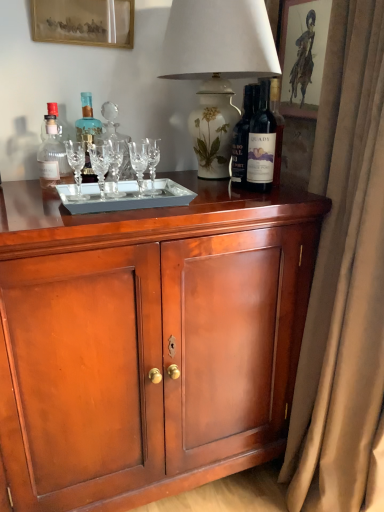
Find the location of a particular element. beige velvet curtain at right is located at coordinates (344, 280).

Describe the element at coordinates (344, 280) in the screenshot. I see `beige velvet curtain at right` at that location.

The width and height of the screenshot is (384, 512). What do you see at coordinates (217, 64) in the screenshot?
I see `white floral vase at upper center` at bounding box center [217, 64].

Locate an element on the screen. white floral vase at upper center is located at coordinates pos(217,64).

Measure the distance between matte brown picture frame at upper right, which ranks as the 2th picture frame in left-to-right order, and camera.

4.32 feet.

You are a GUI agent. You are given a task and a screenshot of the screen. Output one action in this format:
    pyautogui.click(x=<x>, y=<y>)
    Task: Click on the gold-framed picture at upper left, which appears as the second picture frame when viewed from the right
    
    Given the screenshot: What is the action you would take?
    tap(84, 22)

Where is `matte glass bottle at left, the first bottle from the left`? This screenshot has height=512, width=384. matte glass bottle at left, the first bottle from the left is located at coordinates (52, 154).

Which is in front, matte glass bottle at left, the third bottle from the right, or gold-framed picture at upper left, which appears as the second picture frame when viewed from the right?

matte glass bottle at left, the third bottle from the right, is more forward.

Which object is wider, matte glass bottle at left, the third bottle from the right, or gold-framed picture at upper left, which appears as the second picture frame when viewed from the right?

matte glass bottle at left, the third bottle from the right, is wider.

Can you tell me how much matte glass bottle at left, the third bottle from the right, and gold-framed picture at upper left, which appears as the second picture frame when viewed from the right, differ in facing direction?

0.162 degrees separate the facing orientations of matte glass bottle at left, the third bottle from the right, and gold-framed picture at upper left, which appears as the second picture frame when viewed from the right.

From the image's perspective, is matte glass bottle at left, the first bottle from the left, below gold-framed picture at upper left, which appears as the second picture frame when viewed from the right?

Correct, matte glass bottle at left, the first bottle from the left, appears lower than gold-framed picture at upper left, which appears as the second picture frame when viewed from the right, in the image.

Can you confirm if mahogany cabinet at center is positioned to the left of matte brown picture frame at upper right, the first picture frame viewed from the right?

Correct, you'll find mahogany cabinet at center to the left of matte brown picture frame at upper right, the first picture frame viewed from the right.

How much distance is there between mahogany cabinet at center and matte brown picture frame at upper right, the first picture frame viewed from the right?

mahogany cabinet at center and matte brown picture frame at upper right, the first picture frame viewed from the right, are 33.36 inches apart from each other.

Which is behind, point (38, 333) or point (296, 87)?

The point (296, 87) is farther.

From the image's perspective, is mahogany cabinet at center on matte brown picture frame at upper right, the first picture frame viewed from the right?

No, from the image's perspective, mahogany cabinet at center is not over matte brown picture frame at upper right, the first picture frame viewed from the right.

Does matte brown picture frame at upper right, the first picture frame viewed from the right, have a greater height compared to beige velvet curtain at right?

Incorrect, the height of matte brown picture frame at upper right, the first picture frame viewed from the right, is not larger of that of beige velvet curtain at right.

Where is `the 1st picture frame above the beige velvet curtain at right (from a real-world perspective)`? The width and height of the screenshot is (384, 512). the 1st picture frame above the beige velvet curtain at right (from a real-world perspective) is located at coordinates (302, 55).

Can we say matte brown picture frame at upper right, which ranks as the 2th picture frame in left-to-right order, lies outside beige velvet curtain at right?

Yes, matte brown picture frame at upper right, which ranks as the 2th picture frame in left-to-right order, is outside of beige velvet curtain at right.

Is matte brown picture frame at upper right, the first picture frame viewed from the right, wider or thinner than beige velvet curtain at right?

Considering their sizes, matte brown picture frame at upper right, the first picture frame viewed from the right, looks slimmer than beige velvet curtain at right.

Which object is thinner, white floral vase at upper center or matte brown picture frame at upper right, the first picture frame viewed from the right?

matte brown picture frame at upper right, the first picture frame viewed from the right, is thinner.

From a real-world perspective, count 1st picture frames upward from the white floral vase at upper center and point to it. Please provide its 2D coordinates.

[(302, 55)]

In the scene shown: Is the surface of white floral vase at upper center in direct contact with matte brown picture frame at upper right, which ranks as the 2th picture frame in left-to-right order?

They are not placed beside each other.

Considering the sizes of matte brown picture frame at upper right, which ranks as the 2th picture frame in left-to-right order, and mahogany cabinet at center in the image, is matte brown picture frame at upper right, which ranks as the 2th picture frame in left-to-right order, bigger or smaller than mahogany cabinet at center?

Considering their sizes, matte brown picture frame at upper right, which ranks as the 2th picture frame in left-to-right order, takes up less space than mahogany cabinet at center.

From the image's perspective, between matte brown picture frame at upper right, the first picture frame viewed from the right, and mahogany cabinet at center, who is located below?

From the image's view, mahogany cabinet at center is below.

How many degrees apart are the facing directions of matte brown picture frame at upper right, the first picture frame viewed from the right, and mahogany cabinet at center?

89.2 degrees.

Which object is positioned more to the right, matte brown picture frame at upper right, the first picture frame viewed from the right, or mahogany cabinet at center?

From the viewer's perspective, matte brown picture frame at upper right, the first picture frame viewed from the right, appears more on the right side.

Looking at the image, does dark glass bottle at upper right, arranged as the 1th bottle when viewed from the right, seem bigger or smaller compared to matte glass bottle at left, the third bottle from the right?

Considering their sizes, dark glass bottle at upper right, arranged as the 1th bottle when viewed from the right, takes up more space than matte glass bottle at left, the third bottle from the right.

Which is more to the right, dark glass bottle at upper right, arranged as the 1th bottle when viewed from the right, or matte glass bottle at left, the third bottle from the right?

From the viewer's perspective, dark glass bottle at upper right, arranged as the 1th bottle when viewed from the right, appears more on the right side.

Image resolution: width=384 pixels, height=512 pixels. I want to click on the 1st bottle behind when counting from the dark glass bottle at upper right, arranged as the 1th bottle when viewed from the right, so click(x=52, y=154).

Considering the relative sizes of dark glass bottle at upper right, which ranks as the third bottle in left-to-right order, and matte glass bottle at left, the third bottle from the right, in the image provided, is dark glass bottle at upper right, which ranks as the third bottle in left-to-right order, shorter than matte glass bottle at left, the third bottle from the right,?

No.

From a real-world perspective, is white floral vase at upper center located higher than mahogany cabinet at center?

Correct, in the physical world, white floral vase at upper center is higher than mahogany cabinet at center.

Between point (204, 11) and point (56, 298), which one is positioned behind?

Point (204, 11)

Does white floral vase at upper center have a lesser width compared to mahogany cabinet at center?

Yes, white floral vase at upper center is thinner than mahogany cabinet at center.

Which is more to the left, white floral vase at upper center or mahogany cabinet at center?

mahogany cabinet at center.

Identify the location of the 2nd picture frame above the matte glass bottle at left, the third bottle from the right (from a real-world perspective). This screenshot has width=384, height=512. (84, 22).

At what (x,y) coordinates should I click in order to perform the action: click on the 1st picture frame positioned above the mahogany cabinet at center (from the image's perspective). Please return your answer as a coordinate pair (x, y). This screenshot has width=384, height=512. Looking at the image, I should click on (302, 55).

From the image, which object appears to be nearer to dark glass bottle at upper right, arranged as the 1th bottle when viewed from the right, blue glass bottle at center, which is the 2th bottle from right to left, or mahogany cabinet at center?

The object closer to dark glass bottle at upper right, arranged as the 1th bottle when viewed from the right, is mahogany cabinet at center.

Consider the image. When comparing their distances from gold-framed picture at upper left, marked as the first picture frame in a left-to-right arrangement, does matte brown picture frame at upper right, which ranks as the 2th picture frame in left-to-right order, or matte glass bottle at left, the first bottle from the left, seem further?

matte brown picture frame at upper right, which ranks as the 2th picture frame in left-to-right order.

Looking at the image, which one is located closer to blue glass bottle at center, which is the 2th bottle from right to left, matte glass bottle at left, the first bottle from the left, or matte brown picture frame at upper right, which ranks as the 2th picture frame in left-to-right order?

matte glass bottle at left, the first bottle from the left, lies closer to blue glass bottle at center, which is the 2th bottle from right to left, than the other object.

Based on the photo, based on their spatial positions, is dark glass bottle at upper right, which ranks as the third bottle in left-to-right order, or matte brown picture frame at upper right, the first picture frame viewed from the right, further from matte glass bottle at left, the first bottle from the left?

matte brown picture frame at upper right, the first picture frame viewed from the right, lies further to matte glass bottle at left, the first bottle from the left, than the other object.

Consider the image. Considering their positions, is mahogany cabinet at center positioned further to matte glass bottle at left, the first bottle from the left, than white floral vase at upper center?

mahogany cabinet at center lies further to matte glass bottle at left, the first bottle from the left, than the other object.

Estimate the real-world distances between objects in this image. Which object is closer to matte glass bottle at left, the first bottle from the left, matte brown picture frame at upper right, which ranks as the 2th picture frame in left-to-right order, or blue glass bottle at center, positioned as the second bottle in left-to-right order?

blue glass bottle at center, positioned as the second bottle in left-to-right order, lies closer to matte glass bottle at left, the first bottle from the left, than the other object.

From the image, which object appears to be farther from mahogany cabinet at center, white floral vase at upper center or matte glass bottle at left, the first bottle from the left?

matte glass bottle at left, the first bottle from the left.

Considering their positions, is blue glass bottle at center, positioned as the second bottle in left-to-right order, positioned closer to dark glass bottle at upper right, arranged as the 1th bottle when viewed from the right, than beige velvet curtain at right?

beige velvet curtain at right.

You are a GUI agent. You are given a task and a screenshot of the screen. Output one action in this format:
    pyautogui.click(x=<x>, y=<y>)
    Task: Click on the picture frame between matte glass bottle at left, the third bottle from the right, and matte brown picture frame at upper right, which ranks as the 2th picture frame in left-to-right order, from left to right
    
    Given the screenshot: What is the action you would take?
    pyautogui.click(x=84, y=22)

Where is `curtain between white floral vase at upper center and mahogany cabinet at center in the vertical direction`? This screenshot has width=384, height=512. curtain between white floral vase at upper center and mahogany cabinet at center in the vertical direction is located at coordinates (344, 280).

Where is `table lamp situated between gold-framed picture at upper left, which appears as the second picture frame when viewed from the right, and matte brown picture frame at upper right, the first picture frame viewed from the right, from left to right`? table lamp situated between gold-framed picture at upper left, which appears as the second picture frame when viewed from the right, and matte brown picture frame at upper right, the first picture frame viewed from the right, from left to right is located at coordinates (217, 64).

Identify the location of table lamp between matte brown picture frame at upper right, which ranks as the 2th picture frame in left-to-right order, and dark glass bottle at upper right, which ranks as the third bottle in left-to-right order, in the up-down direction. Image resolution: width=384 pixels, height=512 pixels. (217, 64).